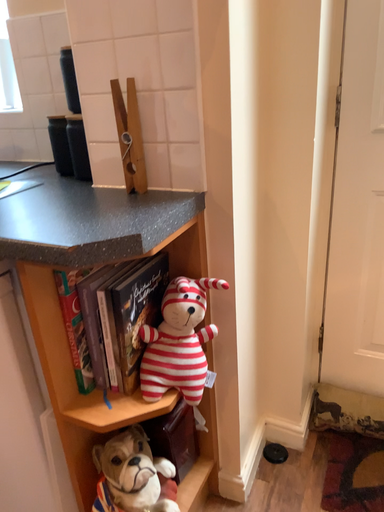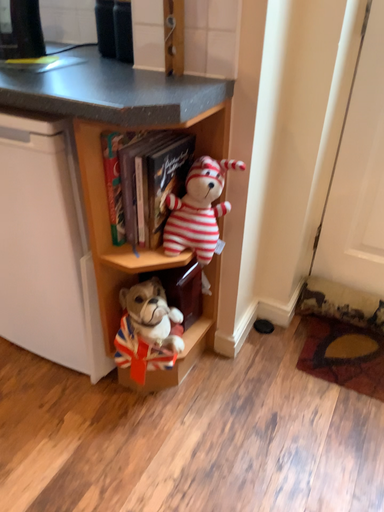
Question: Which way did the camera rotate in the video?

Choices:
 (A) rotated upward
 (B) rotated downward

Answer: (B)